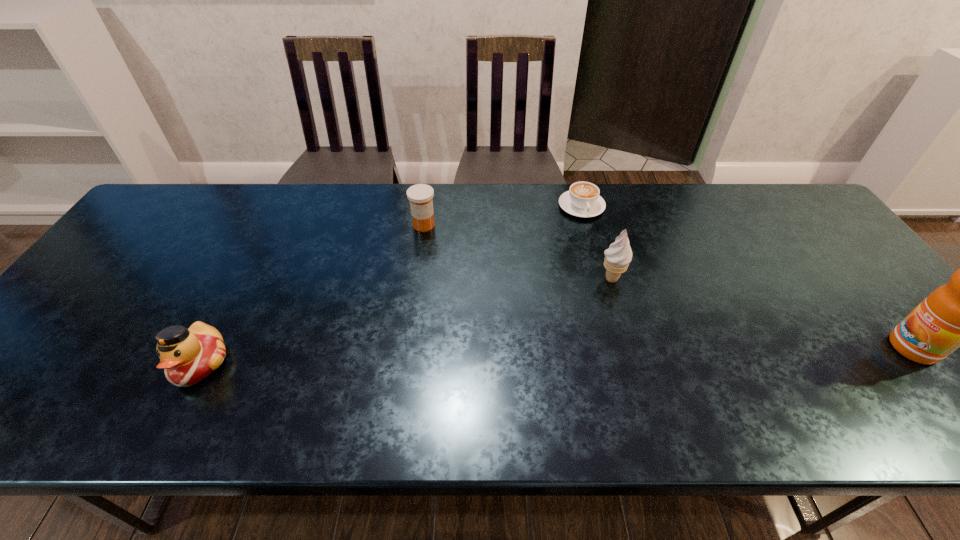
Identify the location of free space located 0.120m on the front-facing side of the fourth shortest object. Image resolution: width=960 pixels, height=540 pixels. (567, 303).

This screenshot has width=960, height=540. I want to click on vacant space situated on the front-facing side of the fourth shortest object, so (507, 338).

Locate an element on the screen. The width and height of the screenshot is (960, 540). vacant area situated 0.270m on the front-facing side of the fourth shortest object is located at coordinates (520, 330).

Where is `free spot located 0.280m on the side of the cappuccino with the handle`? free spot located 0.280m on the side of the cappuccino with the handle is located at coordinates tap(612, 289).

The image size is (960, 540). I want to click on vacant space located on the side of the cappuccino with the handle, so click(x=612, y=292).

The width and height of the screenshot is (960, 540). I want to click on free region located 0.300m on the side of the cappuccino with the handle, so click(x=613, y=294).

Find the location of `free space located 0.370m on the label of the medicine`. free space located 0.370m on the label of the medicine is located at coordinates (461, 329).

This screenshot has height=540, width=960. Find the location of `vacant space located 0.150m on the label of the medicine`. vacant space located 0.150m on the label of the medicine is located at coordinates point(439,267).

This screenshot has width=960, height=540. I want to click on vacant space located on the label of the medicine, so click(x=458, y=323).

This screenshot has width=960, height=540. What are the coordinates of `cappuccino situated at the far edge` in the screenshot? It's located at (583, 200).